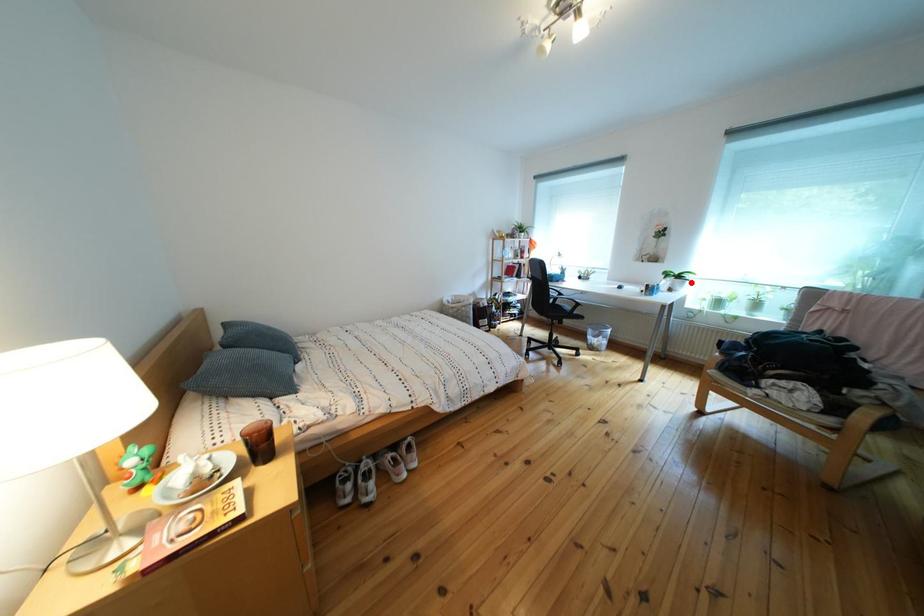
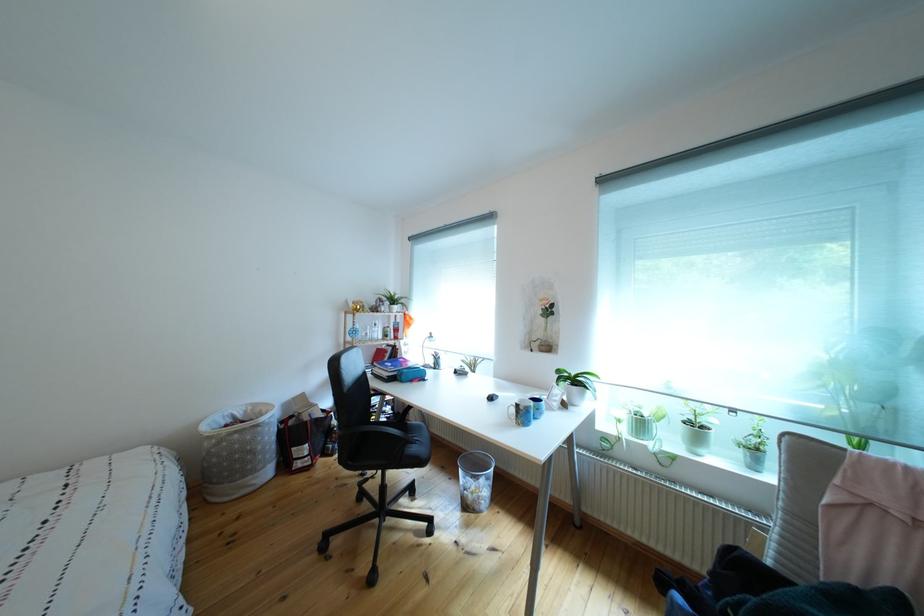
Find the pixel in the second image that matches the highlighted location in the first image.

(588, 387)